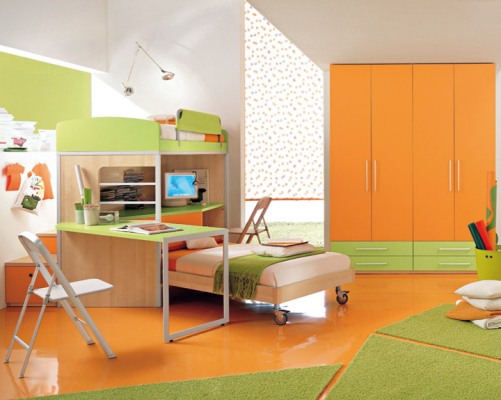
I want to click on white wall, so click(x=184, y=60).